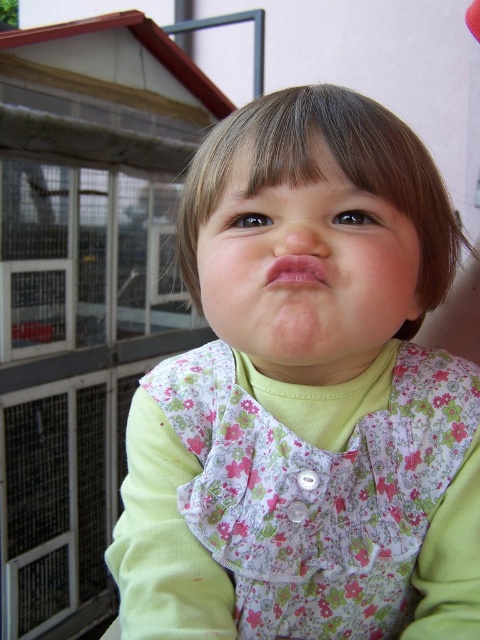
Question: Among these points, which one is farthest from the camera?

Choices:
 (A) pyautogui.click(x=424, y=237)
 (B) pyautogui.click(x=325, y=273)
 (C) pyautogui.click(x=275, y=228)

Answer: (A)

Question: Which is farther from the smooth skin face at center?

Choices:
 (A) floral fabric dress at center
 (B) pink matte lips at center

Answer: (A)

Question: Is floral fabric dress at center below pink matte lips at center?

Choices:
 (A) no
 (B) yes

Answer: (B)

Question: Can you confirm if smooth skin face at center is positioned to the left of pink matte lips at center?

Choices:
 (A) no
 (B) yes

Answer: (A)

Question: Is smooth skin face at center closer to the viewer compared to pink matte lips at center?

Choices:
 (A) yes
 (B) no

Answer: (A)

Question: Which point is farther from the camera taking this photo?

Choices:
 (A) (279, 278)
 (B) (242, 326)

Answer: (B)